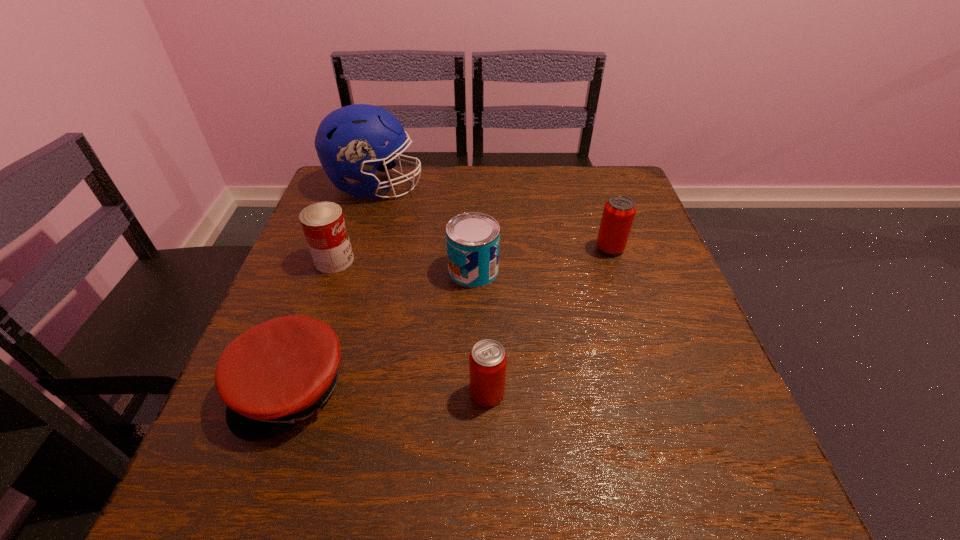
This screenshot has height=540, width=960. I want to click on free point that satisfies the following two spatial constraints: 1. on the back side of the rightmost object; 2. on the front-facing side of the football helmet, so click(x=589, y=187).

At what (x,y) coordinates should I click in order to perform the action: click on vacant region that satisfies the following two spatial constraints: 1. at the front of the cap where the visor is located; 2. on the left side of the nearest can. Please return your answer as a coordinate pair (x, y). Looking at the image, I should click on (291, 393).

Image resolution: width=960 pixels, height=540 pixels. I want to click on vacant region that satisfies the following two spatial constraints: 1. on the front-facing side of the farthest object; 2. on the left side of the nearest can, so click(312, 393).